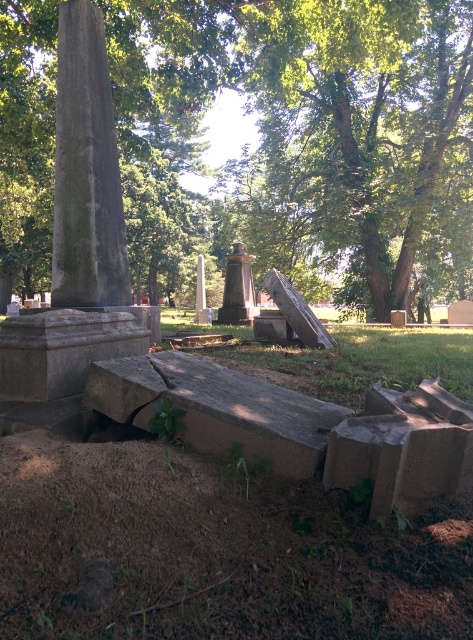
Who is taller, smooth gray stone pillar at center or polished bronze statue at center?

Standing taller between the two is smooth gray stone pillar at center.

Does smooth gray stone pillar at center appear under polished bronze statue at center?

Actually, smooth gray stone pillar at center is above polished bronze statue at center.

Which is behind, point (96, 285) or point (235, 276)?

Point (235, 276)

Where is `smooth gray stone pillar at center`? The image size is (473, 640). smooth gray stone pillar at center is located at coordinates (86, 170).

Is point (471, 205) positioned after point (201, 275)?

No.

Can you confirm if green rough bark tree at upper left is taller than smooth gray stone obelisk at center?

Yes, green rough bark tree at upper left is taller than smooth gray stone obelisk at center.

Is point (148, 113) less distant than point (201, 294)?

Yes, it is in front of point (201, 294).

Locate an element on the screen. The width and height of the screenshot is (473, 640). green rough bark tree at upper left is located at coordinates (305, 136).

Who is shorter, smooth gray stone at center or smooth gray stone obelisk at center?

smooth gray stone at center is shorter.

Does smooth gray stone at center appear on the right side of smooth gray stone obelisk at center?

Correct, you'll find smooth gray stone at center to the right of smooth gray stone obelisk at center.

What do you see at coordinates (217, 408) in the screenshot? Image resolution: width=473 pixels, height=640 pixels. I see `smooth gray stone at center` at bounding box center [217, 408].

The height and width of the screenshot is (640, 473). I want to click on smooth gray stone at center, so click(217, 408).